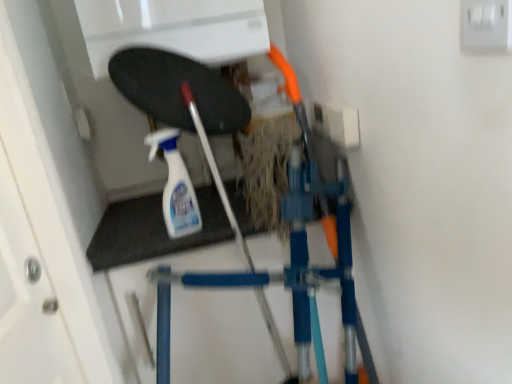
Locate an element on the screen. The width and height of the screenshot is (512, 384). white plastic switch at upper right is located at coordinates (486, 25).

What is the approximate width of white plastic switch at upper right?

white plastic switch at upper right is 0.62 inches wide.

What do you see at coordinates (486, 25) in the screenshot?
I see `white plastic switch at upper right` at bounding box center [486, 25].

At what (x,y) coordinates should I click in order to perform the action: click on clear plastic spray bottle at center. Please return your answer as a coordinate pair (x, y). Image resolution: width=512 pixels, height=384 pixels. Looking at the image, I should click on (175, 186).

Describe the element at coordinates (175, 186) in the screenshot. I see `clear plastic spray bottle at center` at that location.

Find the location of a particular element. This screenshot has height=384, width=512. white plastic switch at upper right is located at coordinates (486, 25).

Considering the relative positions of white plastic switch at upper right and clear plastic spray bottle at center in the image provided, is white plastic switch at upper right to the right of clear plastic spray bottle at center from the viewer's perspective?

Indeed, white plastic switch at upper right is positioned on the right side of clear plastic spray bottle at center.

Is white plastic switch at upper right further to camera compared to clear plastic spray bottle at center?

No, it is not.

Does point (504, 26) appear closer or farther from the camera than point (170, 197)?

Point (504, 26) appears to be closer to the viewer than point (170, 197).

From the image's perspective, is white plastic switch at upper right positioned above or below clear plastic spray bottle at center?

white plastic switch at upper right is situated higher than clear plastic spray bottle at center in the image.

From a real-world perspective, is white plastic switch at upper right over clear plastic spray bottle at center?

Yes, from a real-world perspective, white plastic switch at upper right is on top of clear plastic spray bottle at center.

Considering the sizes of white plastic switch at upper right and clear plastic spray bottle at center in the image, is white plastic switch at upper right wider or thinner than clear plastic spray bottle at center?

In the image, white plastic switch at upper right appears to be more narrow than clear plastic spray bottle at center.

In terms of height, does white plastic switch at upper right look taller or shorter compared to clear plastic spray bottle at center?

white plastic switch at upper right is shorter than clear plastic spray bottle at center.

Can you confirm if white plastic switch at upper right is smaller than clear plastic spray bottle at center?

Yes, white plastic switch at upper right is smaller than clear plastic spray bottle at center.

Is white plastic switch at upper right completely or partially outside of clear plastic spray bottle at center?

Result: white plastic switch at upper right lies outside clear plastic spray bottle at center's area.

Is white plastic switch at upper right placed right next to clear plastic spray bottle at center?

white plastic switch at upper right and clear plastic spray bottle at center are not in contact.

Is white plastic switch at upper right turned away from clear plastic spray bottle at center?

white plastic switch at upper right is not turned away from clear plastic spray bottle at center.

Can you tell me how much white plastic switch at upper right and clear plastic spray bottle at center differ in facing direction?

white plastic switch at upper right and clear plastic spray bottle at center are facing 104 degrees away from each other.

Locate an element on the screen. The width and height of the screenshot is (512, 384). cleaning product on the left side of white plastic switch at upper right is located at coordinates (175, 186).

Is clear plastic spray bottle at center at the left side of white plastic switch at upper right?

Yes.

Is clear plastic spray bottle at center behind white plastic switch at upper right?

Yes, clear plastic spray bottle at center is further from the viewer.

Does point (172, 232) appear closer or farther from the camera than point (476, 34)?

Point (172, 232).

From the image's perspective, is clear plastic spray bottle at center beneath white plastic switch at upper right?

Correct, clear plastic spray bottle at center appears lower than white plastic switch at upper right in the image.

From a real-world perspective, who is located higher, clear plastic spray bottle at center or white plastic switch at upper right?

From a 3D spatial view, white plastic switch at upper right is above.

Is clear plastic spray bottle at center thinner than white plastic switch at upper right?

Incorrect, the width of clear plastic spray bottle at center is not less than that of white plastic switch at upper right.

Based on the photo, in terms of height, does clear plastic spray bottle at center look taller or shorter compared to white plastic switch at upper right?

Clearly, clear plastic spray bottle at center is taller compared to white plastic switch at upper right.

Does clear plastic spray bottle at center have a larger size compared to white plastic switch at upper right?

Yes, clear plastic spray bottle at center is bigger than white plastic switch at upper right.

Is clear plastic spray bottle at center inside or outside of white plastic switch at upper right?

clear plastic spray bottle at center is spatially situated outside white plastic switch at upper right.

Is clear plastic spray bottle at center far away from white plastic switch at upper right?

No, clear plastic spray bottle at center is not far away from white plastic switch at upper right.

Is clear plastic spray bottle at center facing towards white plastic switch at upper right?

No, clear plastic spray bottle at center is not aimed at white plastic switch at upper right.

How distant is clear plastic spray bottle at center from white plastic switch at upper right?

They are 29.29 inches apart.

At what (x,y) coordinates should I click in order to perform the action: click on electric outlet located above the clear plastic spray bottle at center (from the image's perspective). Please return your answer as a coordinate pair (x, y). Looking at the image, I should click on (486, 25).

Where is `electric outlet in front of the clear plastic spray bottle at center`? The image size is (512, 384). electric outlet in front of the clear plastic spray bottle at center is located at coordinates pyautogui.click(x=486, y=25).

At what (x,y) coordinates should I click in order to perform the action: click on electric outlet positioned vertically above the clear plastic spray bottle at center (from a real-world perspective). Please return your answer as a coordinate pair (x, y). Looking at the image, I should click on (486, 25).